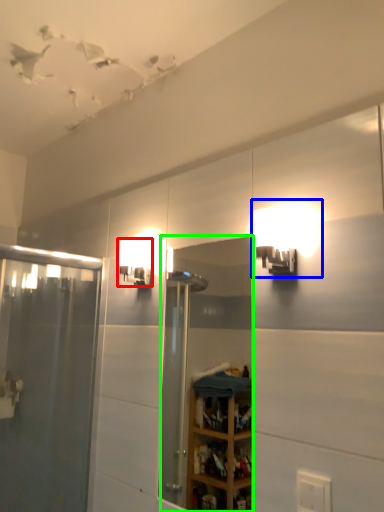
Question: Which object is the farthest from light fixture (highlighted by a red box)? Choose among these: light fixture (highlighted by a blue box) or mirror (highlighted by a green box).

Choices:
 (A) light fixture
 (B) mirror

Answer: (B)